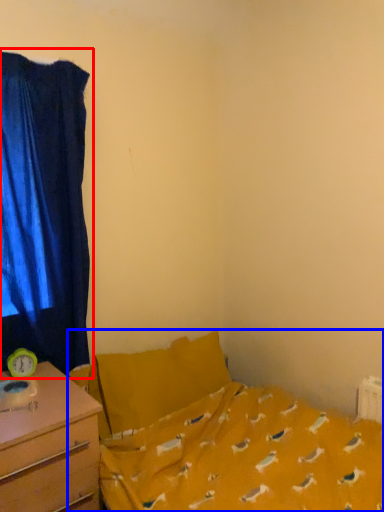
Question: Among these objects, which one is nearest to the camera, curtain (highlighted by a red box) or bed (highlighted by a blue box)?

Choices:
 (A) curtain
 (B) bed

Answer: (B)